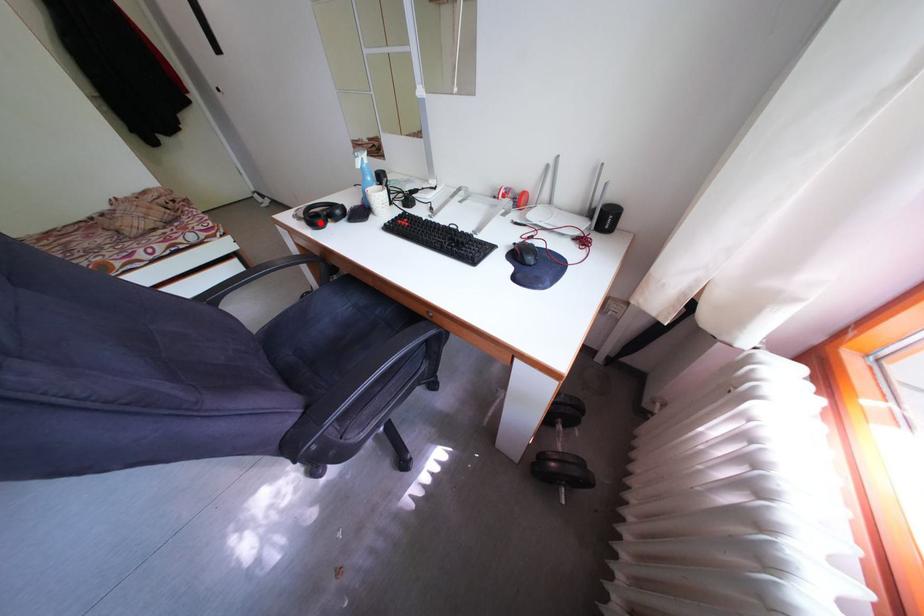
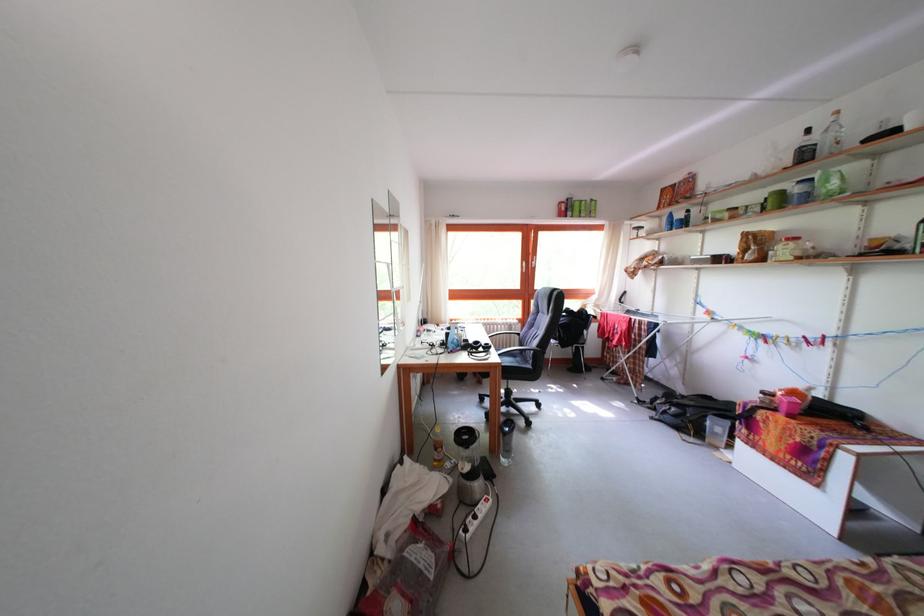
Question: I am providing you with two images of the same scene from different viewpoints. Given a red point in image1, look at the same physical point in image2. Is it:

Choices:
 (A) Closer to the viewpoint
 (B) Farther from the viewpoint

Answer: (B)